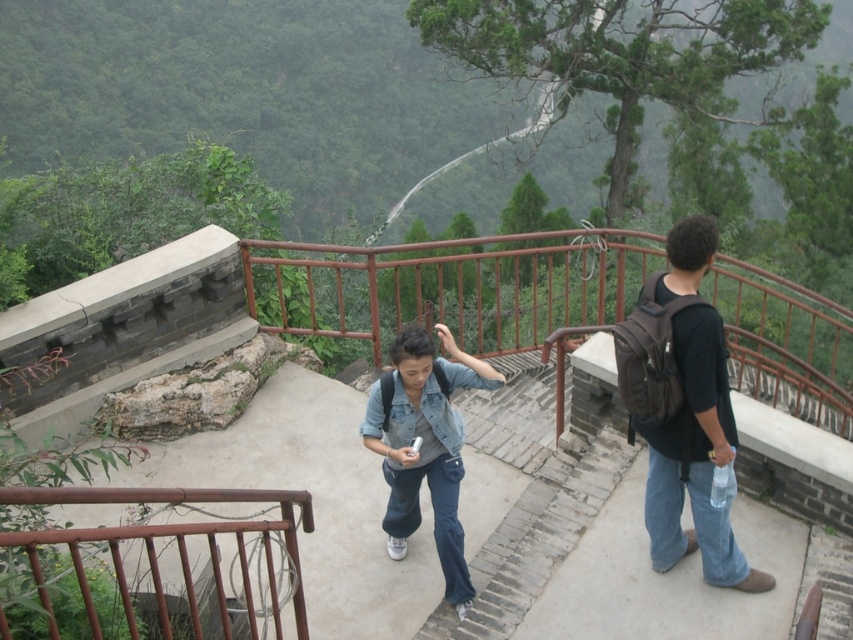
You are standing at the observation deck and want to take a photo of the black backpack at right. Where should you position yourself to capture it in the frame?

The black backpack at right is located at point (695, 458), so you should position yourself to the right side of the scene to ensure it is centered in your camera frame.

You are a hiker planning to place your gear on the railing for a better view. Is the black backpack at right currently blocking the rusty metal railing at upper left?

The black backpack at right is positioned over the rusty metal railing at upper left, so it is currently blocking access to the railing.

You are standing at the viewpoint and want to reach the point marked as point (680, 433). If you walk straight ahead, will you reach it before walking 4 meters?

The distance between you and point (680, 433) is 3.98 meters, so yes, you will reach it before walking 4 meters.